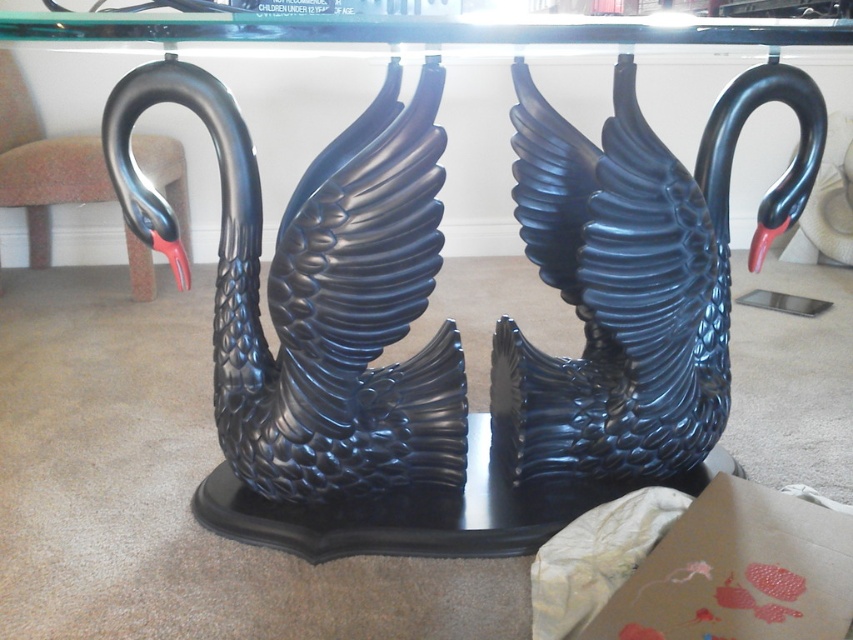
You are standing in front of the two black swan sculptures on the dark wooden base. You want to take a photo of the glossy black swan at left without the other swan appearing in the frame. Given your camera has a fixed focal length, can you estimate if moving closer or farther away from the base would help achieve this?

The glossy black swan at left is 3.77 feet away from the camera. To avoid the other swan in the frame, you should move closer to the base to narrow the field of view, making the swans appear farther apart relative to the camera. However, since both swans are on the same base, moving closer might still include both unless the camera angle is adjusted. Alternatively, moving farther away could make both smaller but might not exclude the other swan. The exact distance needed depends on the camera sensor size, 3

You are arranging flowers between the glossy black swan at left and the glossy black swan at center. Which swan should you place the flowers in front of to ensure they are visible from the front of the base?

The glossy black swan at center is above the glossy black swan at left, so placing flowers in front of the glossy black swan at center would ensure visibility from the front of the base.

You are standing in front of two black swan sculptures on a dark wooden base. You notice a point at coordinates (317, 292). Which swan does this point belong to?

The point at (317, 292) belongs to the glossy black swan at left.